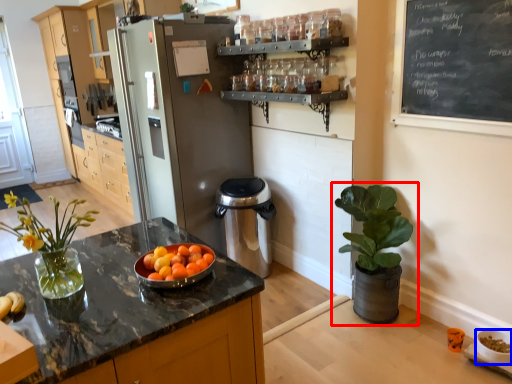
Question: Which object appears farthest to the camera in this image, houseplant (highlighted by a red box) or glass bowl (highlighted by a blue box)?

Choices:
 (A) houseplant
 (B) glass bowl

Answer: (A)